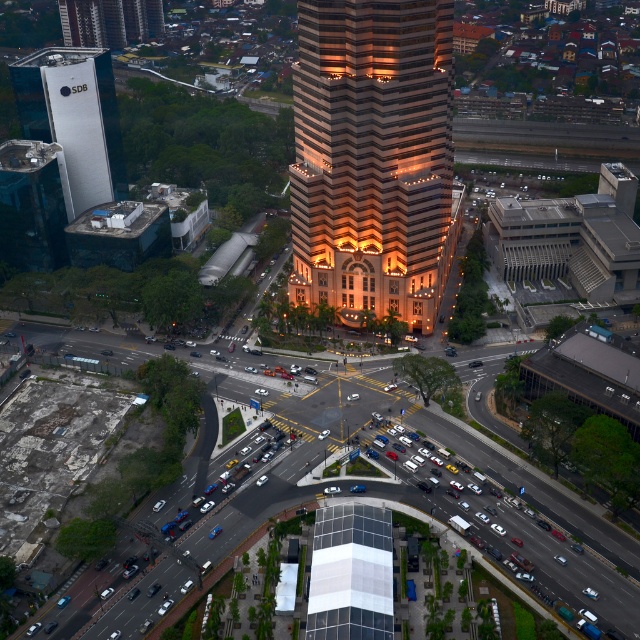
In the scene shown: Who is taller, golden glass skyscraper at center or matte glass skyscraper at upper left?

Standing taller between the two is golden glass skyscraper at center.

Which is behind, point (404, 237) or point (84, 180)?

The point (84, 180) is behind.

The width and height of the screenshot is (640, 640). I want to click on golden glass skyscraper at center, so click(x=372, y=157).